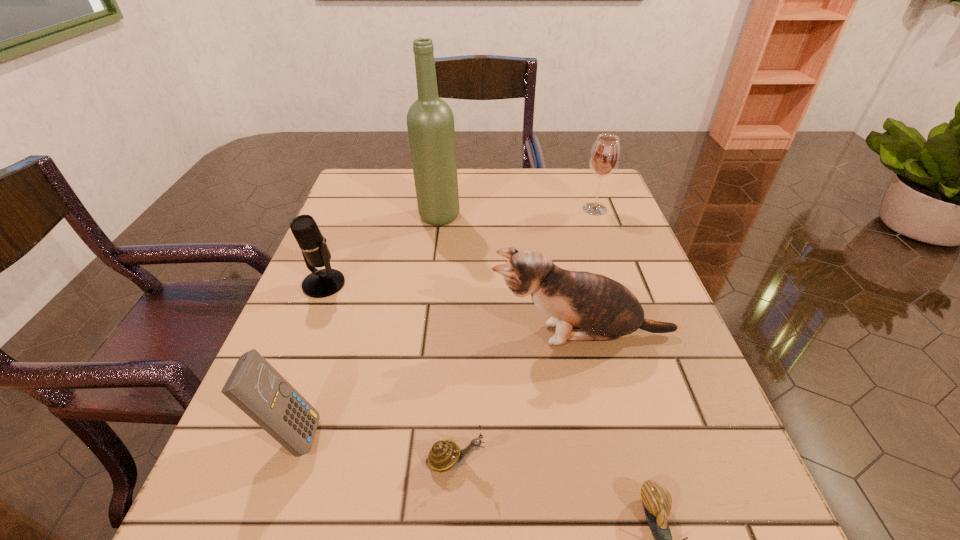
Find the location of a particular element. This screenshot has height=540, width=960. cat that is at the right edge is located at coordinates (605, 309).

Identify the location of object that is at the far right corner. (605, 154).

In the image, there is a desktop. At what (x,y) coordinates should I click in order to perform the action: click on vacant area at the far edge. Please return your answer as a coordinate pair (x, y). Looking at the image, I should click on (527, 172).

In the image, there is a desktop. Identify the location of vacant space at the left edge. The height and width of the screenshot is (540, 960). (373, 303).

This screenshot has width=960, height=540. Find the location of `vacant space at the right edge of the desktop`. vacant space at the right edge of the desktop is located at coordinates (632, 237).

Locate an element on the screen. This screenshot has width=960, height=540. free space at the far left corner of the desktop is located at coordinates (380, 174).

In the image, there is a desktop. Identify the location of vacant space at the near left corner. This screenshot has width=960, height=540. (201, 517).

What are the coordinates of `vacant space at the far right corner of the desktop` in the screenshot? It's located at (565, 180).

Where is `free space between the fourth nearest object and the third farthest object`? This screenshot has height=540, width=960. free space between the fourth nearest object and the third farthest object is located at coordinates (453, 309).

Identify the location of free space between the tallest object and the fifth nearest object. The width and height of the screenshot is (960, 540). (381, 250).